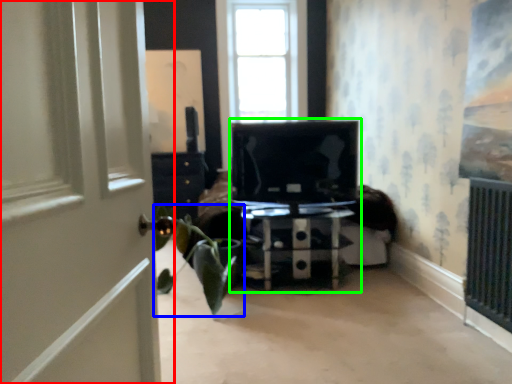
Question: Estimate the real-world distances between objects in this image. Which object is farther from door (highlighted by a red box), houseplant (highlighted by a blue box) or entertainment center (highlighted by a green box)?

Choices:
 (A) houseplant
 (B) entertainment center

Answer: (B)